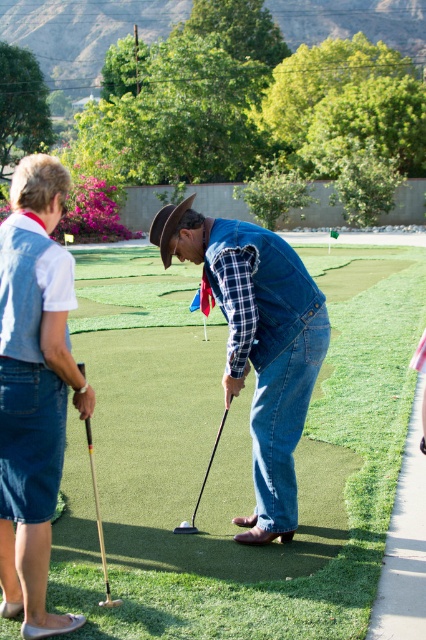
Which of these two, green artificial turf at center or denim/leather cowboy hat at center, stands taller?

green artificial turf at center

Between green artificial turf at center and denim/leather cowboy hat at center, which one is positioned lower?

denim/leather cowboy hat at center is lower down.

Find the location of `green artificial turf at center`. green artificial turf at center is located at coordinates (238, 474).

Who is positioned more to the left, denim/leather cowboy hat at center or black rubber golf club at center?

Positioned to the left is black rubber golf club at center.

Can you confirm if denim/leather cowboy hat at center is positioned to the left of black rubber golf club at center?

No, denim/leather cowboy hat at center is not to the left of black rubber golf club at center.

Where is `denim/leather cowboy hat at center`? The image size is (426, 640). denim/leather cowboy hat at center is located at coordinates (258, 344).

Is point (210, 428) positioned before point (86, 432)?

No, it is behind (86, 432).

Is green artificial turf at center taller than wooden at left?

Correct, green artificial turf at center is much taller as wooden at left.

Image resolution: width=426 pixels, height=640 pixels. Identify the location of green artificial turf at center. (238, 474).